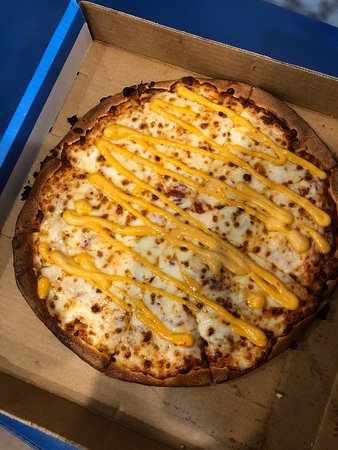
Identify the location of floor background. The width and height of the screenshot is (338, 450). (9, 441).